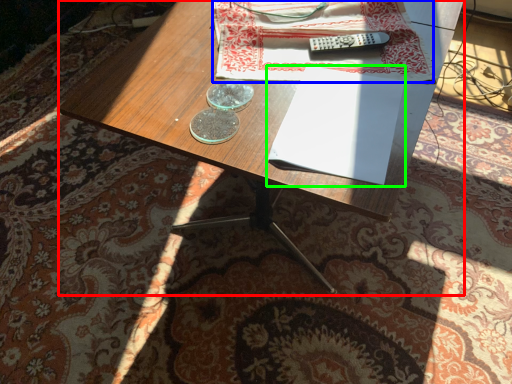
Question: Considering the real-world distances, which object is closest to desk (highlighted by a red box)? sheet (highlighted by a blue box) or paperback book (highlighted by a green box).

Choices:
 (A) sheet
 (B) paperback book

Answer: (A)